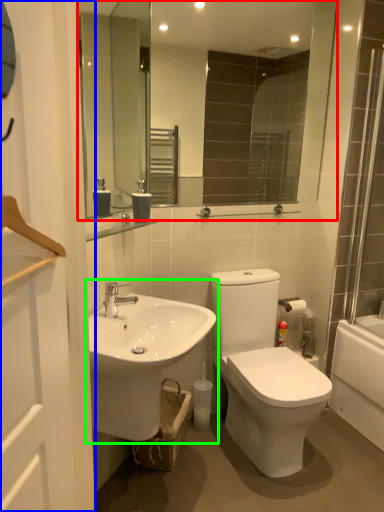
Question: Which is nearer to the mirror (highlighted by a red box)? screen door (highlighted by a blue box) or sink (highlighted by a green box).

Choices:
 (A) screen door
 (B) sink

Answer: (B)